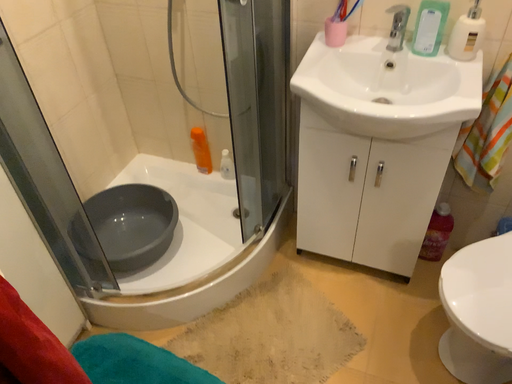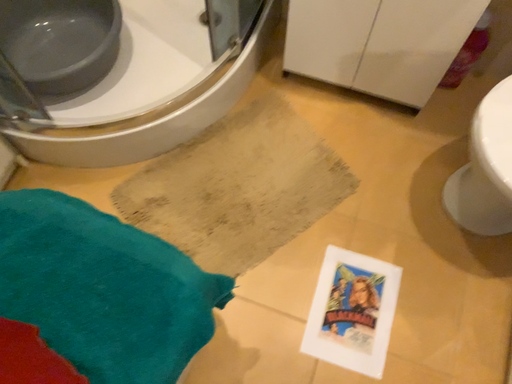
Question: Which way did the camera rotate in the video?

Choices:
 (A) rotated downward
 (B) rotated upward

Answer: (A)